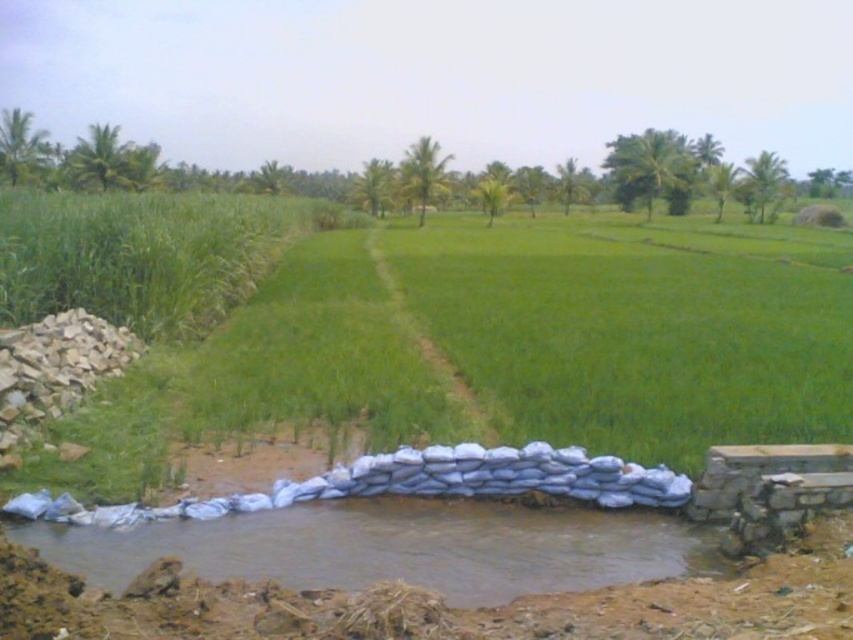
Which is more to the left, green grass at center or brown clay water at lower left?

Positioned to the left is brown clay water at lower left.

Who is more distant from viewer, (x=161, y=349) or (x=590, y=529)?

The point (x=161, y=349) is more distant.

What are the coordinates of `green grass at center` in the screenshot? It's located at (500, 348).